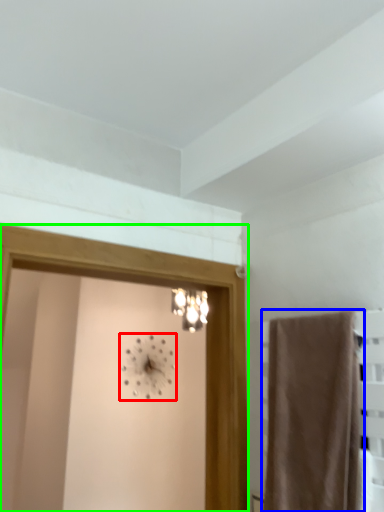
Question: Which is nearer to the clock (highlighted by a red box)? curtain (highlighted by a blue box) or screen door (highlighted by a green box).

Choices:
 (A) curtain
 (B) screen door

Answer: (B)